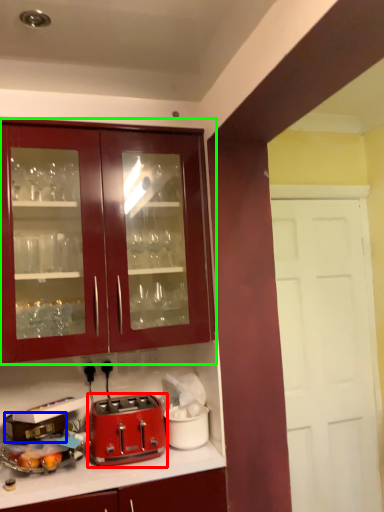
Question: Which is nearer to the toaster (highlighted by a red box)? appliance (highlighted by a blue box) or cabinetry (highlighted by a green box).

Choices:
 (A) appliance
 (B) cabinetry

Answer: (A)